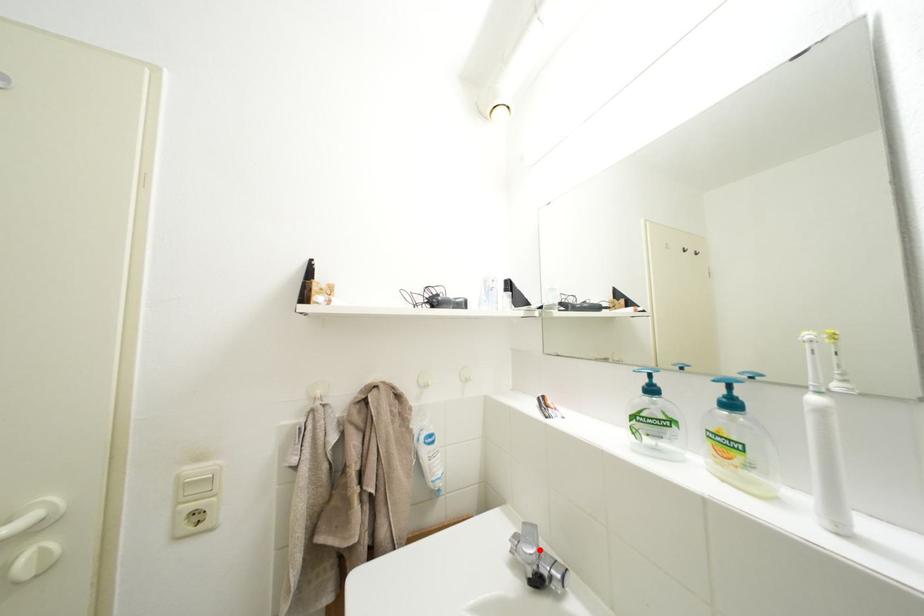
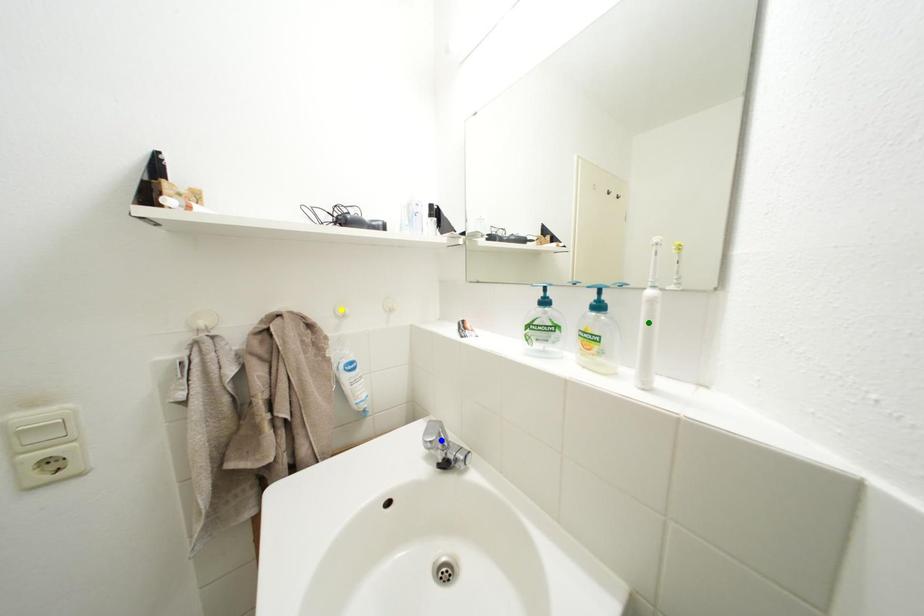
Question: I am providing you with two images of the same scene from different viewpoints. A red point is marked on the first image. You are given multiple points on the second image. Which point in image 2 represents the same 3d spot as the red point in image 1?

Choices:
 (A) green point
 (B) blue point
 (C) yellow point

Answer: (B)